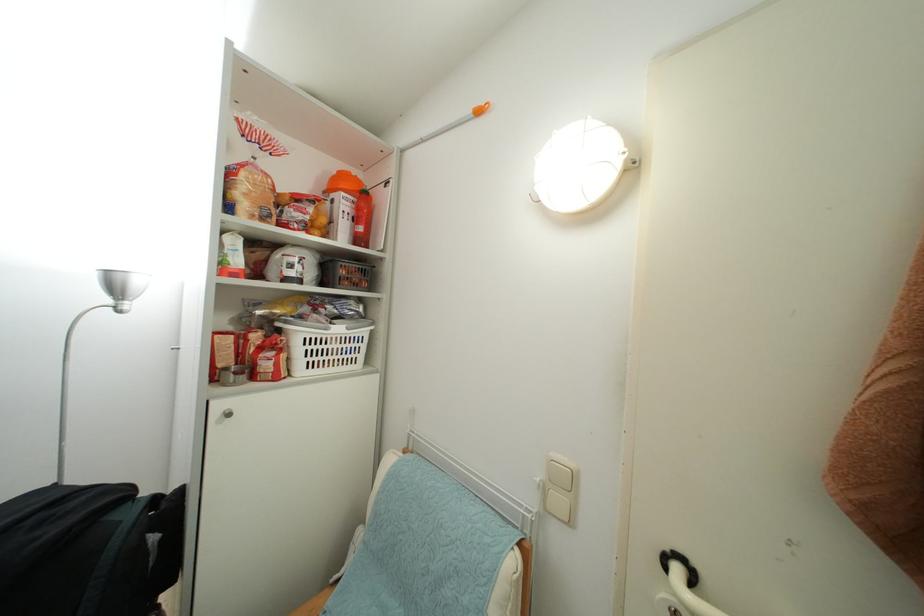
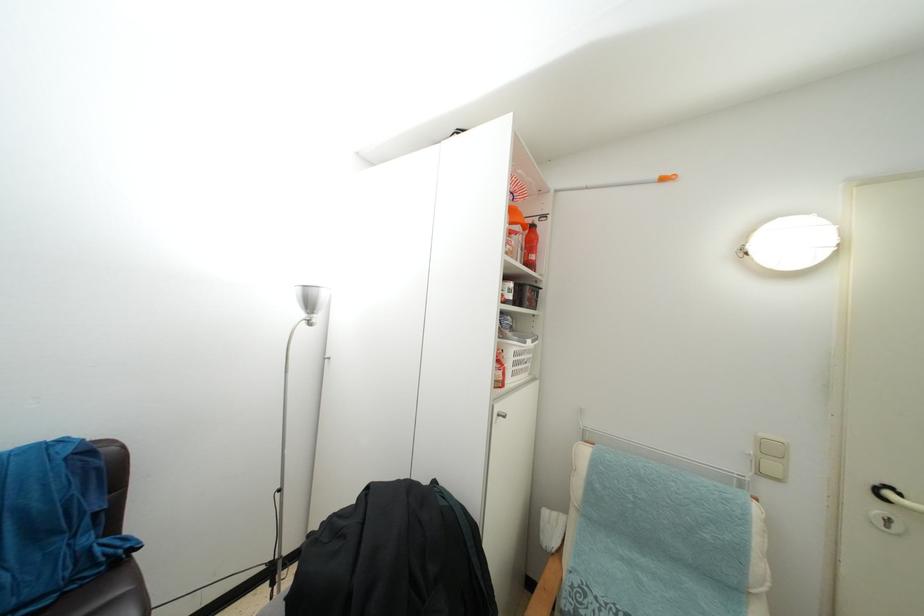
Question: Based on the continuous images, in which direction is the camera rotating? Reply with the corresponding letter.

Choices:
 (A) Left
 (B) Right
 (C) Up
 (D) Down

Answer: (B)